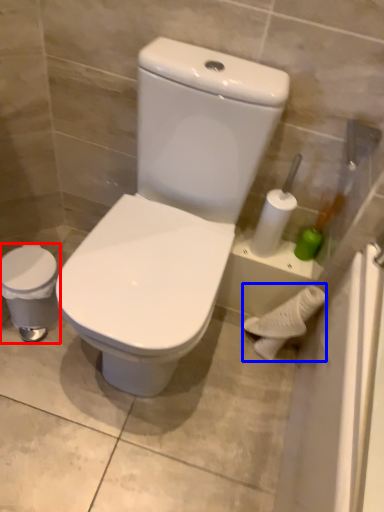
Question: Among these objects, which one is nearest to the camera, porcelain (highlighted by a red box) or porcelain (highlighted by a blue box)?

Choices:
 (A) porcelain
 (B) porcelain

Answer: (A)